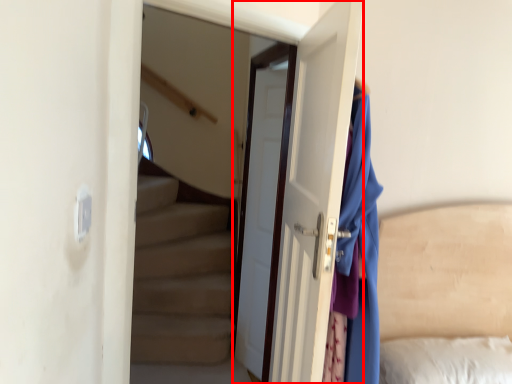
Question: In this image, where is door (annotated by the red box) located relative to door?

Choices:
 (A) left
 (B) right

Answer: (B)